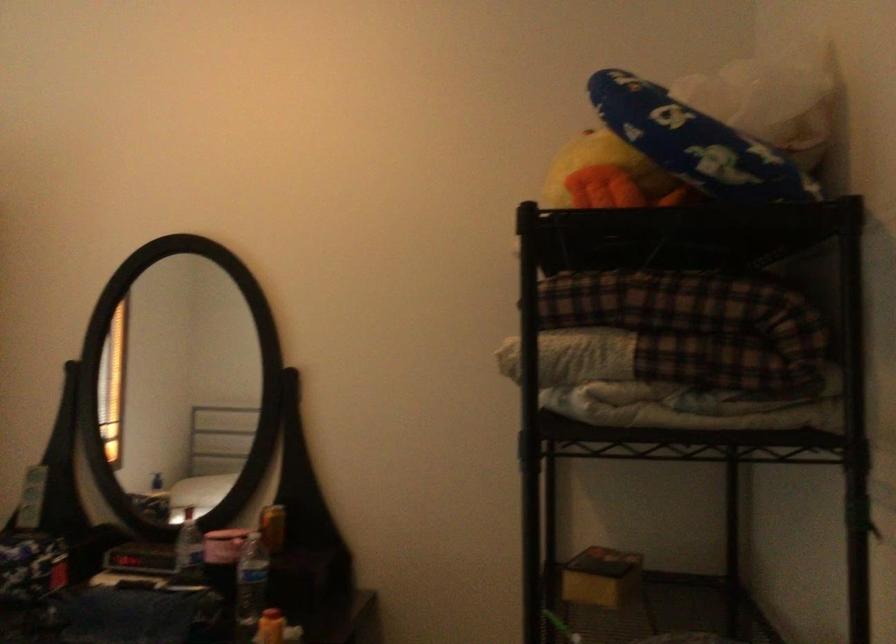
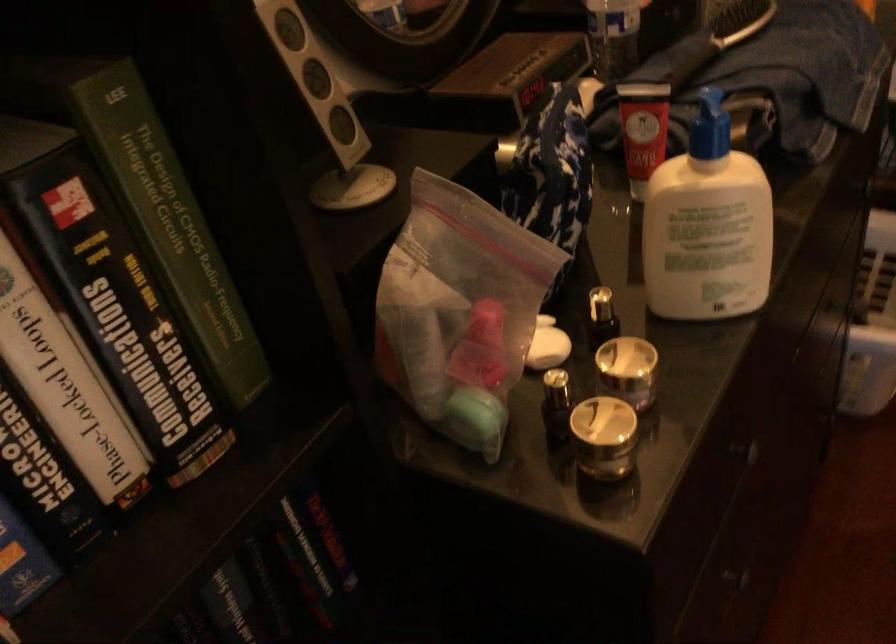
In the second image, find the point that corresponds to point 125,547 in the first image.

(506, 80)